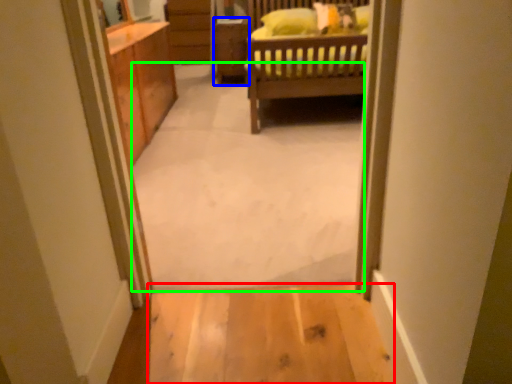
Question: Which object is positioned closest to plain (highlighted by a red box)? Select from cabinetry (highlighted by a blue box) and plain (highlighted by a green box).

Choices:
 (A) cabinetry
 (B) plain

Answer: (B)